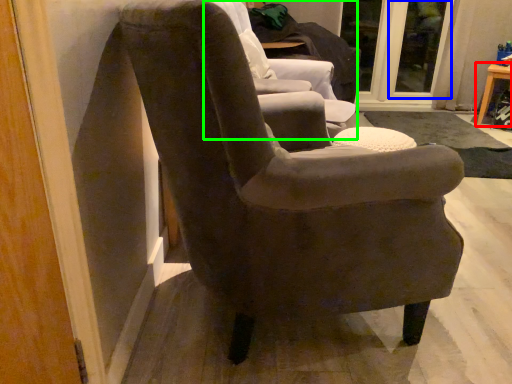
Question: Which is nearer to the table (highlighted by a red box)? glass door (highlighted by a blue box) or chair (highlighted by a green box).

Choices:
 (A) glass door
 (B) chair

Answer: (A)